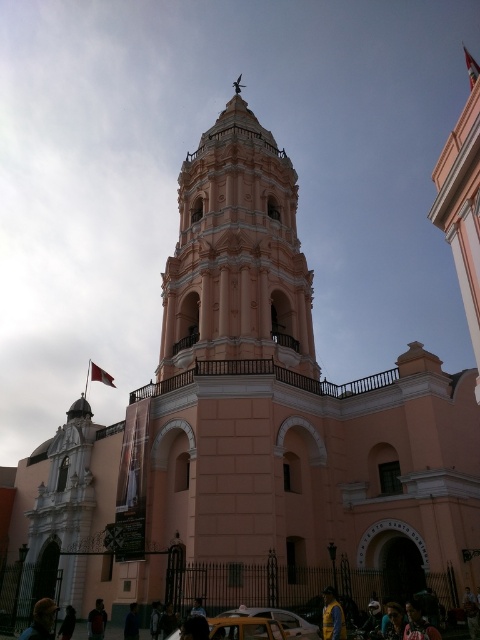
Question: Which of the following is the farthest from the observer?

Choices:
 (A) yellow fabric at lower center
 (B) metallic gold car at center
 (C) dark brown leather jacket at lower left

Answer: (C)

Question: Which is nearer to the yellow fabric at lower center?

Choices:
 (A) metallic gold car at center
 (B) dark blue shirt at center
 (C) yellow matte taxi at lower center
 (D) dark blue shirt at lower center

Answer: (C)

Question: Does pink stone bell tower at center have a larger size compared to dark brown leather jacket at lower left?

Choices:
 (A) yes
 (B) no

Answer: (A)

Question: Considering the real-world distances, which object is farthest from the golden hair at lower left?

Choices:
 (A) dark blue shirt at center
 (B) metallic gold car at center

Answer: (B)

Question: Can you confirm if yellow matte taxi at lower center is bigger than yellow fabric at lower center?

Choices:
 (A) no
 (B) yes

Answer: (B)

Question: Observing the image, what is the correct spatial positioning of metallic gold car at center in reference to golden hair at lower left?

Choices:
 (A) left
 (B) right

Answer: (B)